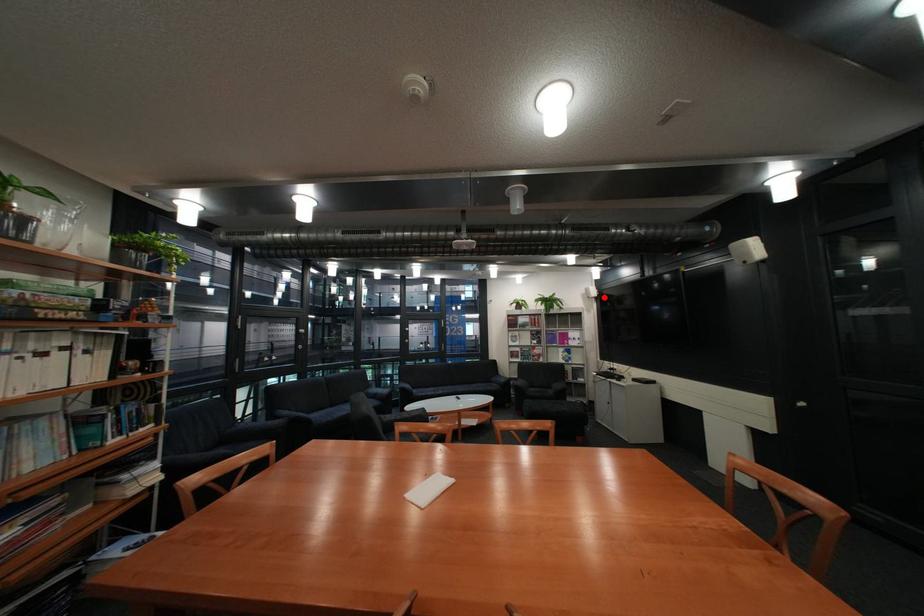
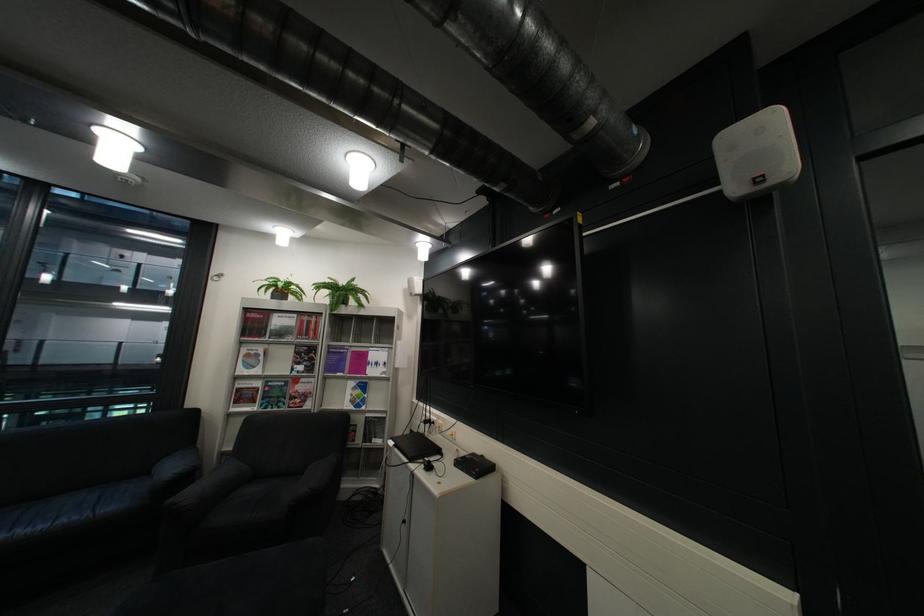
Question: I am providing you with two images of the same scene from different viewpoints. A red point is marked on the first image. At the location where the point appears in image 1, is it still visible in image 2?

Choices:
 (A) Yes
 (B) No

Answer: (A)